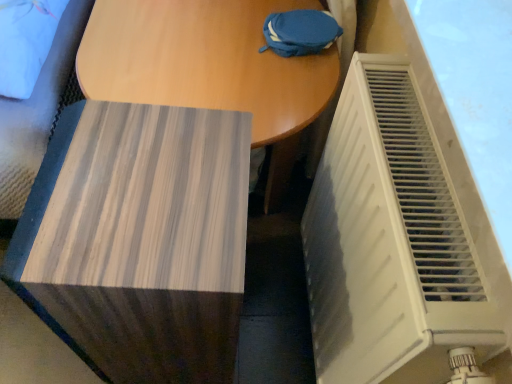
Question: Should I look upward or downward to see wooden table at center?

Choices:
 (A) up
 (B) down

Answer: (A)

Question: Is white plastic radiator at right positioned far away from wooden side table at lower left?

Choices:
 (A) no
 (B) yes

Answer: (A)

Question: From a real-world perspective, is white plastic radiator at right beneath wooden side table at lower left?

Choices:
 (A) no
 (B) yes

Answer: (A)

Question: Is white plastic radiator at right in front of wooden side table at lower left?

Choices:
 (A) yes
 (B) no

Answer: (A)

Question: Can you confirm if white plastic radiator at right is thinner than wooden side table at lower left?

Choices:
 (A) yes
 (B) no

Answer: (A)

Question: Can you confirm if white plastic radiator at right is wider than wooden side table at lower left?

Choices:
 (A) no
 (B) yes

Answer: (A)

Question: From a real-world perspective, is white plastic radiator at right located higher than wooden side table at lower left?

Choices:
 (A) yes
 (B) no

Answer: (A)

Question: Can we say wooden table at center lies outside white plastic radiator at right?

Choices:
 (A) yes
 (B) no

Answer: (A)

Question: Considering the relative positions of wooden table at center and white plastic radiator at right in the image provided, is wooden table at center in front of white plastic radiator at right?

Choices:
 (A) yes
 (B) no

Answer: (B)

Question: Can you confirm if wooden table at center is wider than white plastic radiator at right?

Choices:
 (A) yes
 (B) no

Answer: (A)

Question: Does wooden table at center appear on the right side of white plastic radiator at right?

Choices:
 (A) no
 (B) yes

Answer: (A)

Question: Is wooden table at center further to camera compared to white plastic radiator at right?

Choices:
 (A) yes
 (B) no

Answer: (A)

Question: Does wooden table at center have a greater height compared to white plastic radiator at right?

Choices:
 (A) yes
 (B) no

Answer: (B)

Question: From a real-world perspective, is wooden table at center physically below wooden side table at lower left?

Choices:
 (A) no
 (B) yes

Answer: (B)